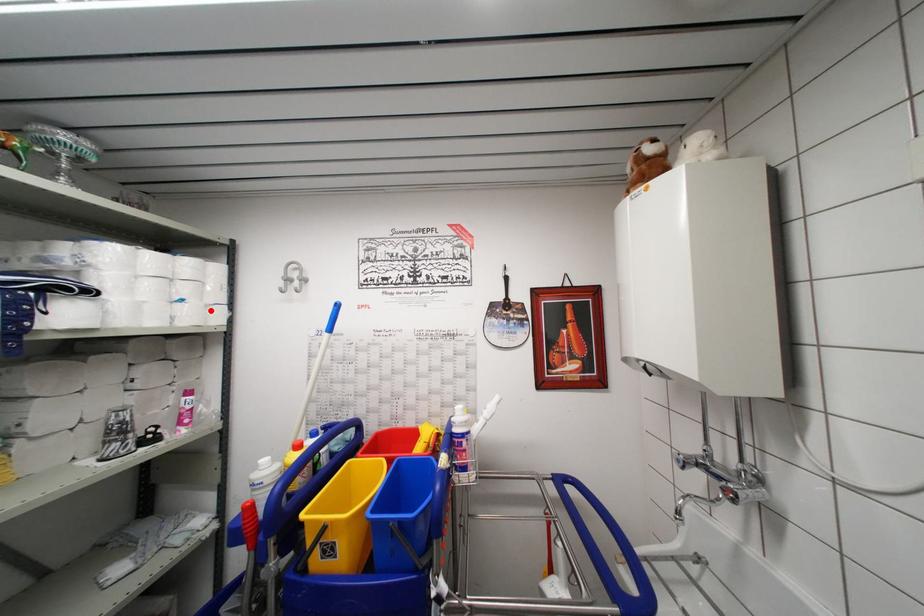
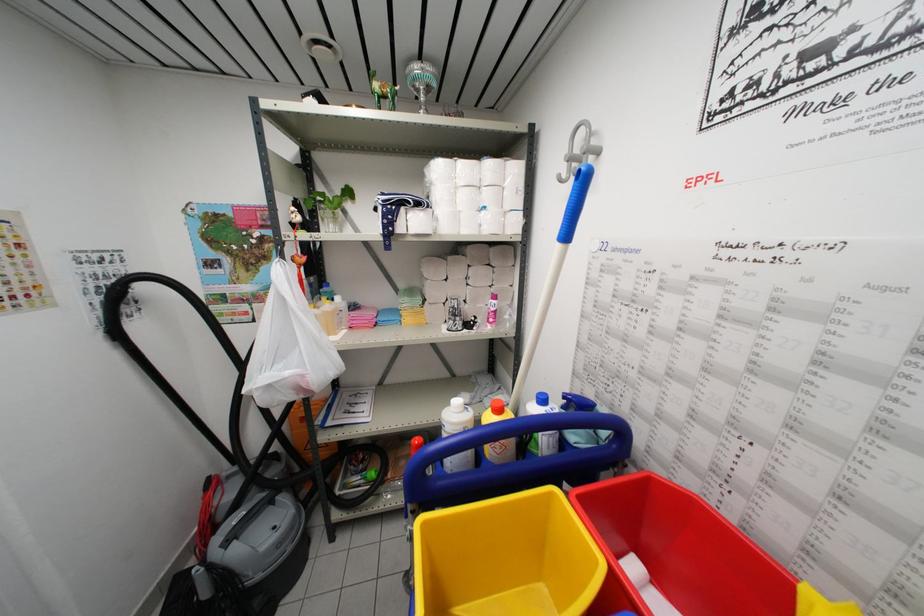
Where in the second image is the point corresponding to the highlighted location from the first image?

(507, 217)